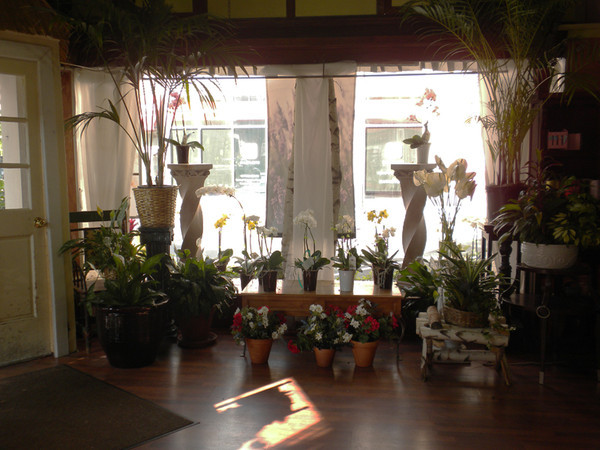
Locate an element on the screen. This screenshot has height=450, width=600. pedestal is located at coordinates (188, 226).